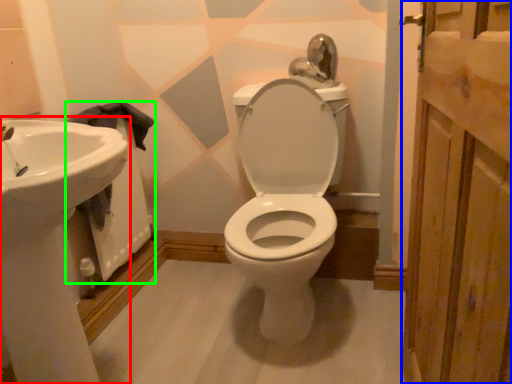
Question: Which is nearer to the sink (highlighted by a red box)? screen door (highlighted by a blue box) or bath (highlighted by a green box).

Choices:
 (A) screen door
 (B) bath

Answer: (B)